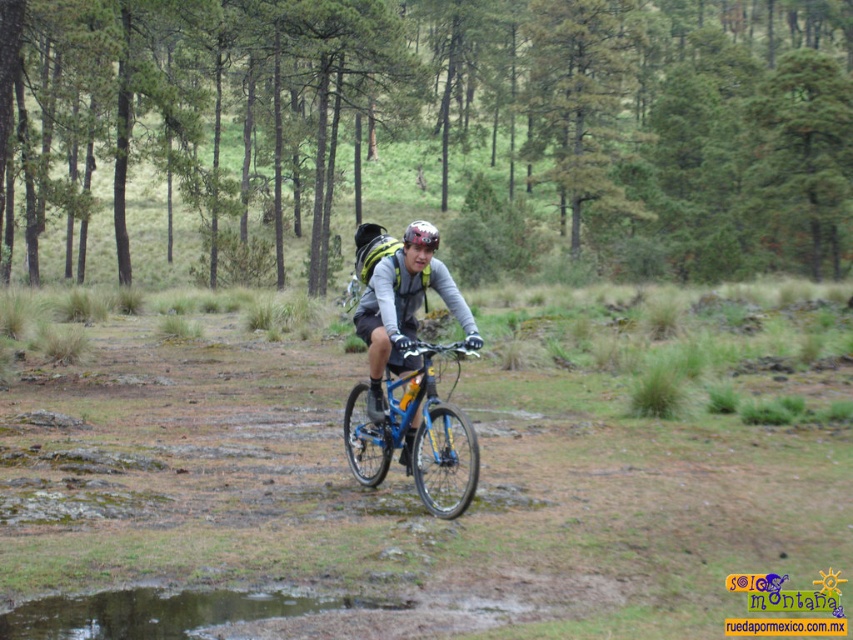
Question: Can you confirm if green matte forest at upper center is positioned to the left of shiny silver helmet at center?

Choices:
 (A) no
 (B) yes

Answer: (B)

Question: Is green matte forest at upper center to the right of shiny dark water at lower left from the viewer's perspective?

Choices:
 (A) yes
 (B) no

Answer: (B)

Question: Which object is farther from the camera taking this photo?

Choices:
 (A) blue metallic bicycle at center
 (B) shiny dark water at lower left

Answer: (A)

Question: Among these objects, which one is farthest from the camera?

Choices:
 (A) shiny silver helmet at center
 (B) green matte forest at upper center
 (C) shiny dark water at lower left

Answer: (B)

Question: Which point appears farthest from the camera in this image?

Choices:
 (A) (418, 444)
 (B) (434, 232)
 (C) (271, 612)

Answer: (A)

Question: Is blue metallic bicycle at center bigger than shiny silver helmet at center?

Choices:
 (A) no
 (B) yes

Answer: (A)